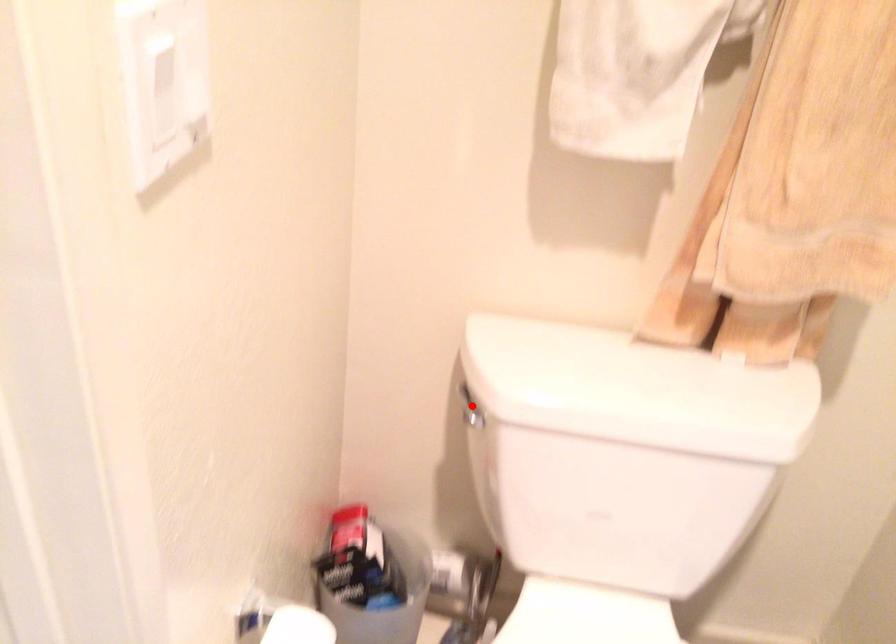
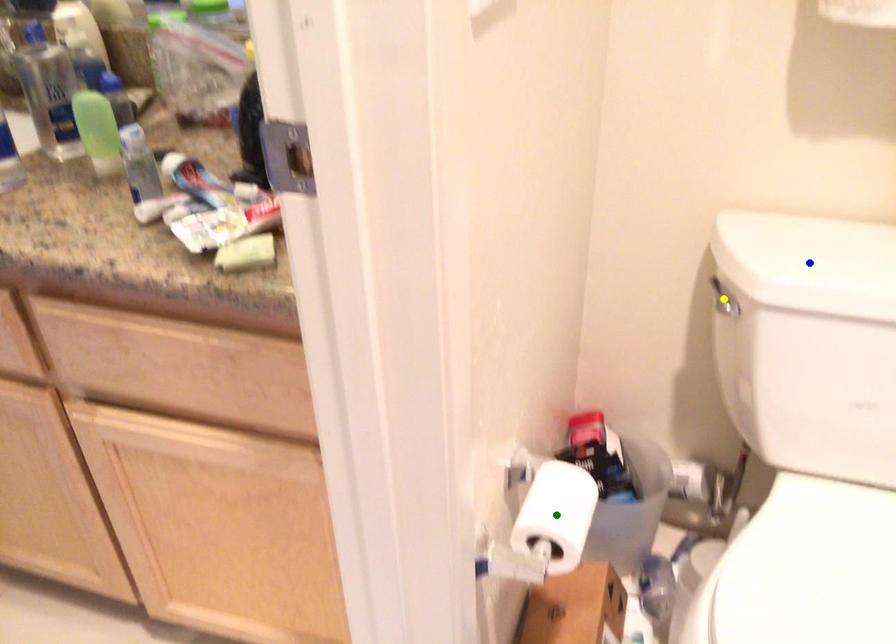
Question: I am providing you with two images of the same scene from different viewpoints. A red point is marked on the first image. You are given multiple points on the second image. Which point in image 2 is actually the same real-world point as the red point in image 1?

Choices:
 (A) blue point
 (B) green point
 (C) yellow point

Answer: (C)